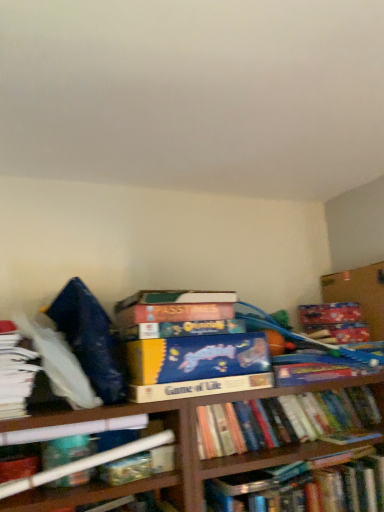
Where is `white paper at left, which is counted as the 1th book, starting from the top`? white paper at left, which is counted as the 1th book, starting from the top is located at coordinates (16, 372).

Image resolution: width=384 pixels, height=512 pixels. Identify the location of hardcover book at center, the first book positioned from the bottom. (303, 474).

Image resolution: width=384 pixels, height=512 pixels. Describe the element at coordinates (282, 420) in the screenshot. I see `hardcover book at center, acting as the 3th book starting from the top` at that location.

You are a GUI agent. You are given a task and a screenshot of the screen. Output one action in this format:
    pyautogui.click(x=<x>, y=<y>)
    Task: Click on the white paper at left, positioned as the 4th book in bottom-to-top order
    
    Given the screenshot: What is the action you would take?
    pyautogui.click(x=16, y=372)

Which object is positioned more to the left, hardcover book at lower left, the 3th book from the bottom, or cardboard box at upper right?

hardcover book at lower left, the 3th book from the bottom.

Between hardcover book at lower left, which is the second book from top to bottom, and cardboard box at upper right, which one has larger size?

hardcover book at lower left, which is the second book from top to bottom, is bigger.

From a real-world perspective, is hardcover book at lower left, the 3th book from the bottom, physically above cardboard box at upper right?

Incorrect, from a real-world perspective, hardcover book at lower left, the 3th book from the bottom, is lower than cardboard box at upper right.

Is cardboard box at upper right to the left of hardcover book at lower left, the 3th book from the bottom, from the viewer's perspective?

Incorrect, cardboard box at upper right is not on the left side of hardcover book at lower left, the 3th book from the bottom.

What's the angular difference between cardboard box at upper right and hardcover book at lower left, the 3th book from the bottom,'s facing directions?

The angular difference between cardboard box at upper right and hardcover book at lower left, the 3th book from the bottom, is 2.19 degrees.

From a real-world perspective, is cardboard box at upper right on hardcover book at lower left, the 3th book from the bottom?

Yes, from a real-world perspective, cardboard box at upper right is over hardcover book at lower left, the 3th book from the bottom

Who is shorter, hardcover book at center, acting as the 3th book starting from the top, or hardcover book at lower left, which is the second book from top to bottom?

hardcover book at center, acting as the 3th book starting from the top, is shorter.

Would you say hardcover book at center, acting as the 3th book starting from the top, contains hardcover book at lower left, the 3th book from the bottom?

Actually, hardcover book at lower left, the 3th book from the bottom, is outside hardcover book at center, acting as the 3th book starting from the top.

Which is more to the left, hardcover book at center, acting as the 3th book starting from the top, or hardcover book at lower left, which is the second book from top to bottom?

Positioned to the left is hardcover book at lower left, which is the second book from top to bottom.

Considering the sizes of objects hardcover book at lower left, the 3th book from the bottom, and hardcover book at center, acting as the 3th book starting from the top, in the image provided, who is bigger, hardcover book at lower left, the 3th book from the bottom, or hardcover book at center, acting as the 3th book starting from the top,?

Bigger between the two is hardcover book at center, acting as the 3th book starting from the top.

From a real-world perspective, is hardcover book at lower left, which is the second book from top to bottom, on hardcover book at center, acting as the 3th book starting from the top?

Yes, from a real-world perspective, hardcover book at lower left, which is the second book from top to bottom, is over hardcover book at center, acting as the 3th book starting from the top

Considering the positions of points (114, 448) and (201, 454), is point (114, 448) farther from camera compared to point (201, 454)?

No.

Is hardcover book at lower left, the 3th book from the bottom, oriented towards hardcover book at center, the second book from the bottom?

No, hardcover book at lower left, the 3th book from the bottom, is not aimed at hardcover book at center, the second book from the bottom.

Is hardcover book at center, the first book positioned from the bottom, completely or partially outside of white paper at left, positioned as the 4th book in bottom-to-top order?

hardcover book at center, the first book positioned from the bottom, is positioned outside white paper at left, positioned as the 4th book in bottom-to-top order.

Is hardcover book at center, placed as the 4th book when sorted from top to bottom, to the right of white paper at left, which is counted as the 1th book, starting from the top, from the viewer's perspective?

Indeed, hardcover book at center, placed as the 4th book when sorted from top to bottom, is positioned on the right side of white paper at left, which is counted as the 1th book, starting from the top.

Which object is more forward, hardcover book at center, the first book positioned from the bottom, or white paper at left, positioned as the 4th book in bottom-to-top order?

white paper at left, positioned as the 4th book in bottom-to-top order, is closer to the camera.

What's the angular difference between hardcover book at center, placed as the 4th book when sorted from top to bottom, and white paper at left, which is counted as the 1th book, starting from the top,'s facing directions?

1.1 degrees.

Considering the sizes of objects white paper at left, which is counted as the 1th book, starting from the top, and cardboard box at upper right in the image provided, who is shorter, white paper at left, which is counted as the 1th book, starting from the top, or cardboard box at upper right?

With less height is white paper at left, which is counted as the 1th book, starting from the top.

From the image's perspective, is white paper at left, positioned as the 4th book in bottom-to-top order, above or below cardboard box at upper right?

From the image's perspective, white paper at left, positioned as the 4th book in bottom-to-top order, appears below cardboard box at upper right.

Is white paper at left, which is counted as the 1th book, starting from the top, not inside cardboard box at upper right?

Absolutely, white paper at left, which is counted as the 1th book, starting from the top, is external to cardboard box at upper right.

Is white paper at left, positioned as the 4th book in bottom-to-top order, closer to the viewer compared to cardboard box at upper right?

Yes, it is.

From a real-world perspective, which is physically below, hardcover book at center, the second book from the bottom, or hardcover book at center, placed as the 4th book when sorted from top to bottom?

In real-world perspective, hardcover book at center, placed as the 4th book when sorted from top to bottom, is lower.

From the image's perspective, is hardcover book at center, acting as the 3th book starting from the top, above or below hardcover book at center, the first book positioned from the bottom?

Clearly, from the image's perspective, hardcover book at center, acting as the 3th book starting from the top, is above hardcover book at center, the first book positioned from the bottom.

Considering the relative sizes of hardcover book at center, the second book from the bottom, and hardcover book at center, the first book positioned from the bottom, in the image provided, is hardcover book at center, the second book from the bottom, taller than hardcover book at center, the first book positioned from the bottom,?

No, hardcover book at center, the second book from the bottom, is not taller than hardcover book at center, the first book positioned from the bottom.

Is point (219, 452) in front of point (236, 478)?

No, it is not.

Which book is the 3rd one when counting from the left side of the cardboard box at upper right? Please provide its 2D coordinates.

[(86, 463)]

Locate an element on the screen. Image resolution: width=384 pixels, height=512 pixels. cardboard box that appears behind the hardcover book at lower left, which is the second book from top to bottom is located at coordinates (359, 294).

From the image, which object appears to be farther from hardcover book at center, the second book from the bottom, cardboard box at upper right or hardcover book at lower left, the 3th book from the bottom?

The object further to hardcover book at center, the second book from the bottom, is cardboard box at upper right.

Considering their positions, is hardcover book at center, the first book positioned from the bottom, positioned closer to white paper at left, which is counted as the 1th book, starting from the top, than cardboard box at upper right?

Among the two, hardcover book at center, the first book positioned from the bottom, is located nearer to white paper at left, which is counted as the 1th book, starting from the top.

From the image, which object appears to be nearer to hardcover book at lower left, which is the second book from top to bottom, cardboard box at upper right or hardcover book at center, acting as the 3th book starting from the top?

Among the two, hardcover book at center, acting as the 3th book starting from the top, is located nearer to hardcover book at lower left, which is the second book from top to bottom.

From the image, which object appears to be farther from hardcover book at center, the second book from the bottom, white paper at left, positioned as the 4th book in bottom-to-top order, or hardcover book at center, placed as the 4th book when sorted from top to bottom?

white paper at left, positioned as the 4th book in bottom-to-top order, is positioned further to the anchor hardcover book at center, the second book from the bottom.

Which object lies further to the anchor point hardcover book at lower left, the 3th book from the bottom, white paper at left, which is counted as the 1th book, starting from the top, or hardcover book at center, the second book from the bottom?

Among the two, hardcover book at center, the second book from the bottom, is located further to hardcover book at lower left, the 3th book from the bottom.

When comparing their distances from hardcover book at center, acting as the 3th book starting from the top, does hardcover book at center, placed as the 4th book when sorted from top to bottom, or cardboard box at upper right seem further?

Based on the image, cardboard box at upper right appears to be further to hardcover book at center, acting as the 3th book starting from the top.

Estimate the real-world distances between objects in this image. Which object is closer to white paper at left, positioned as the 4th book in bottom-to-top order, hardcover book at center, the first book positioned from the bottom, or hardcover book at center, the second book from the bottom?

hardcover book at center, the second book from the bottom.

When comparing their distances from cardboard box at upper right, does hardcover book at lower left, which is the second book from top to bottom, or white paper at left, positioned as the 4th book in bottom-to-top order, seem closer?

Based on the image, hardcover book at lower left, which is the second book from top to bottom, appears to be nearer to cardboard box at upper right.

At what (x,y) coordinates should I click in order to perform the action: click on book situated between white paper at left, which is counted as the 1th book, starting from the top, and hardcover book at center, acting as the 3th book starting from the top, from left to right. Please return your answer as a coordinate pair (x, y). The height and width of the screenshot is (512, 384). Looking at the image, I should click on (86, 463).

Identify the location of book between hardcover book at lower left, which is the second book from top to bottom, and hardcover book at center, the first book positioned from the bottom, in the horizontal direction. Image resolution: width=384 pixels, height=512 pixels. (282, 420).